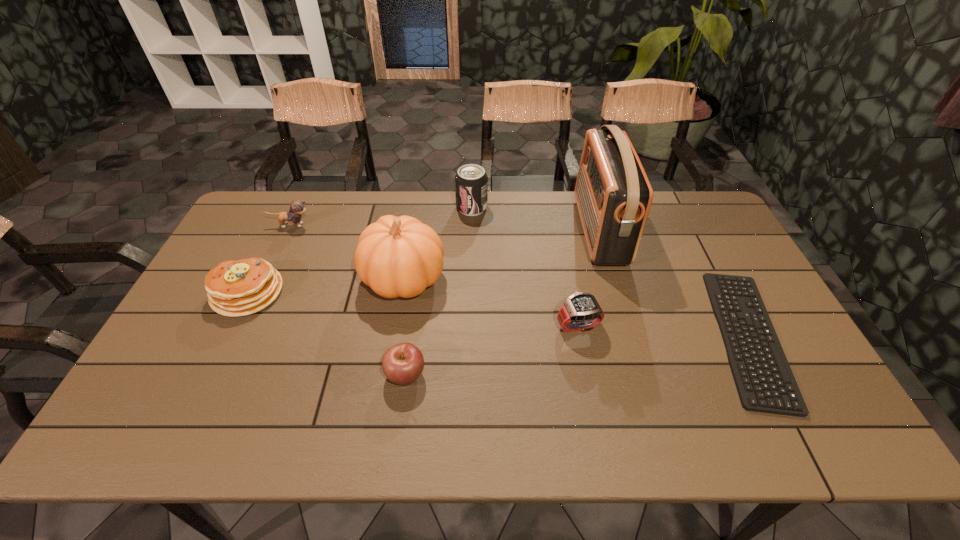
Find the location of a particular element. the shortest object is located at coordinates (765, 383).

The image size is (960, 540). What are the coordinates of `free space located on the front-facing side of the tallest object` in the screenshot? It's located at (507, 230).

Find the location of a particular element. Image resolution: width=960 pixels, height=540 pixels. vacant region located on the front-facing side of the tallest object is located at coordinates (521, 230).

Locate an element on the screen. The width and height of the screenshot is (960, 540). blank space located 0.280m on the front-facing side of the tallest object is located at coordinates (497, 230).

Locate an element on the screen. vacant area located 0.280m on the left of the pumpkin is located at coordinates (269, 279).

Locate an element on the screen. Image resolution: width=960 pixels, height=540 pixels. free region located on the front of the third tallest object is located at coordinates (471, 232).

Locate an element on the screen. Image resolution: width=960 pixels, height=540 pixels. vacant region located on the front-facing side of the kitten is located at coordinates (366, 225).

You are a GUI agent. You are given a task and a screenshot of the screen. Output one action in this format:
    pyautogui.click(x=<x>, y=<y>)
    Task: Click on the free spot located on the front of the pancake
    The image size is (960, 540).
    Given the screenshot: What is the action you would take?
    pyautogui.click(x=192, y=406)

The height and width of the screenshot is (540, 960). In order to click on free space located on the back of the watch in this screenshot , I will do `click(559, 228)`.

The image size is (960, 540). In order to click on vacant space located 0.320m on the side of the apple with the unique marking in this screenshot , I will do `click(554, 374)`.